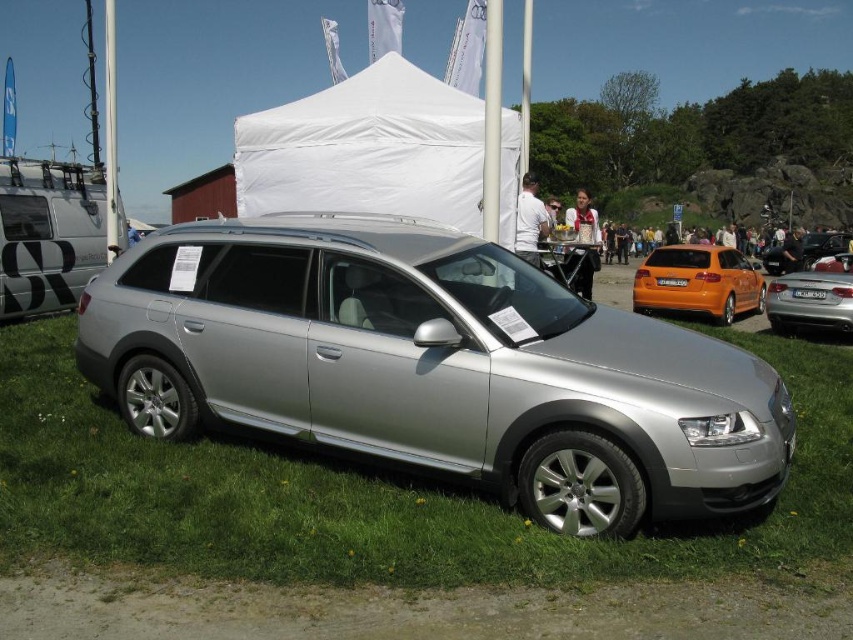
Question: Is silver metallic sedan at right positioned at the back of yellow matte license plate at center?

Choices:
 (A) yes
 (B) no

Answer: (B)

Question: Which point appears closest to the camera in this image?

Choices:
 (A) (346, 125)
 (B) (799, 298)

Answer: (A)

Question: Does white fabric tent at upper center have a greater width compared to white plastic license plate at center?

Choices:
 (A) yes
 (B) no

Answer: (A)

Question: Does satin silver wagon at center appear on the right side of orange matte hatchback at center right?

Choices:
 (A) yes
 (B) no

Answer: (B)

Question: Which is nearer to the satin silver wagon at center?

Choices:
 (A) orange matte hatchback at center right
 (B) yellow matte license plate at center
 (C) white plastic license plate at center

Answer: (C)

Question: Which object appears closest to the camera in this image?

Choices:
 (A) yellow matte license plate at center
 (B) white plastic license plate at center
 (C) orange matte hatchback at center right
 (D) satin silver wagon at center

Answer: (D)